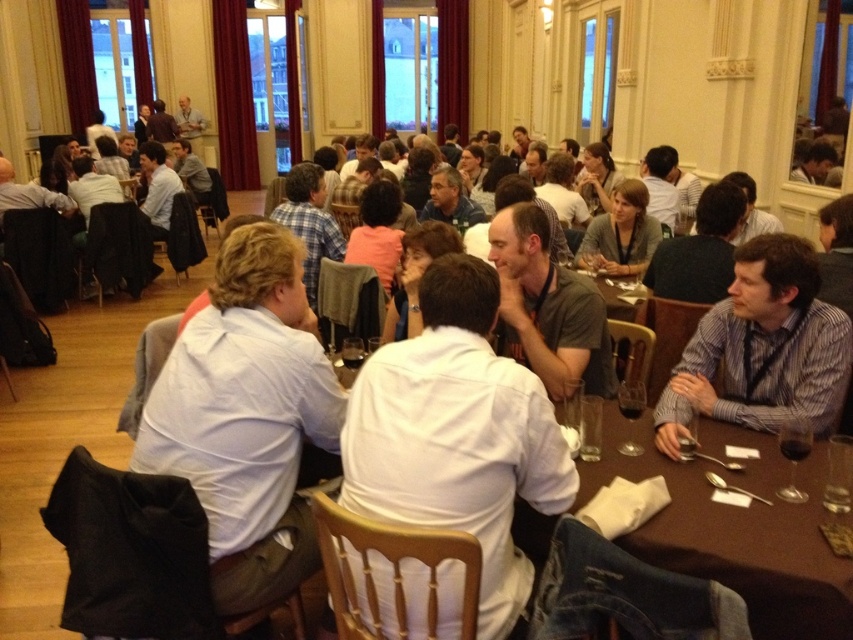
Is point (816, 410) positioned behind point (786, 547)?

Yes, it is.

Between striped cotton shirt at right and brown wooden table at center, which one has less height?

brown wooden table at center is shorter.

Locate an element on the screen. This screenshot has height=640, width=853. striped cotton shirt at right is located at coordinates (761, 348).

Is brown wooden table at lower right below brown wooden table at center?

Yes, brown wooden table at lower right is below brown wooden table at center.

Identify the location of brown wooden table at lower right. (735, 528).

Can you confirm if brown wooden table at lower right is smaller than striped cotton shirt at right?

Actually, brown wooden table at lower right might be larger than striped cotton shirt at right.

Which is above, brown wooden table at lower right or striped cotton shirt at right?

Positioned higher is striped cotton shirt at right.

Image resolution: width=853 pixels, height=640 pixels. I want to click on brown wooden table at lower right, so click(735, 528).